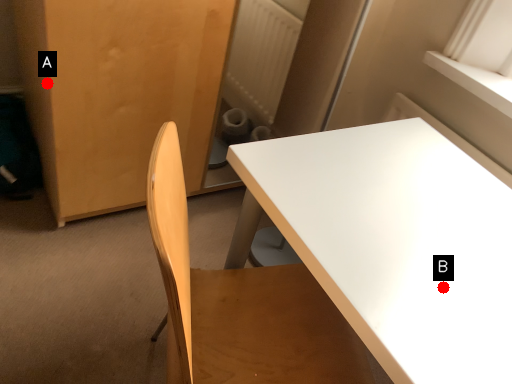
Question: Two points are circled on the image, labeled by A and B beside each circle. Among these points, which one is nearest to the camera?

Choices:
 (A) A is closer
 (B) B is closer

Answer: (B)